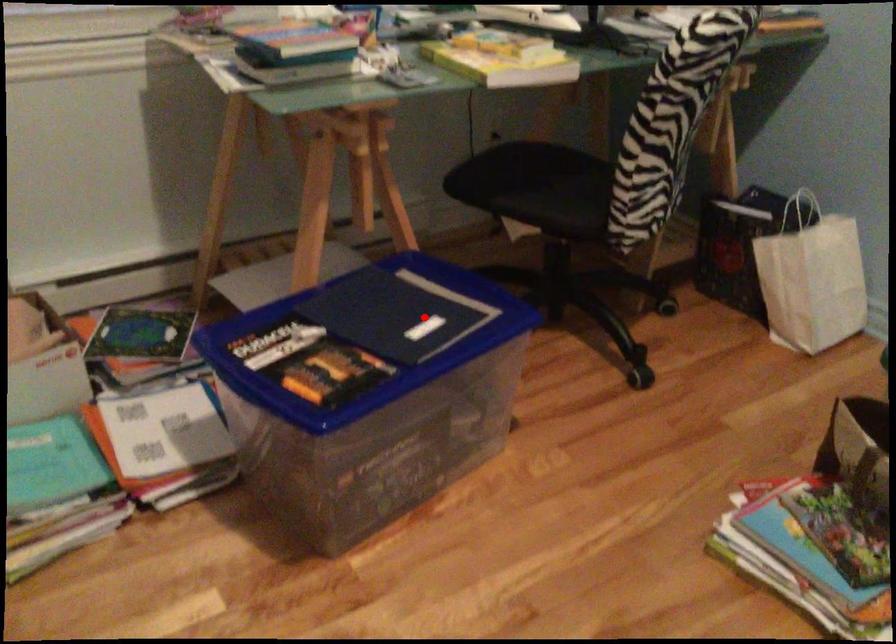
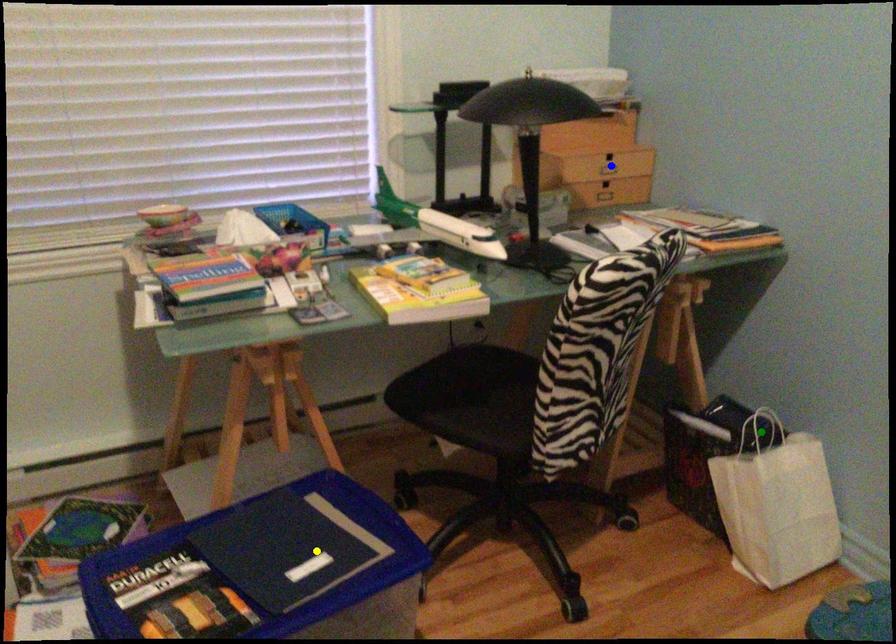
Question: I am providing you with two images of the same scene from different viewpoints. A red point is marked on the first image. You are given multiple points on the second image. Can you choose the point in image 2 that corresponds to the point in image 1?

Choices:
 (A) yellow point
 (B) green point
 (C) blue point

Answer: (A)